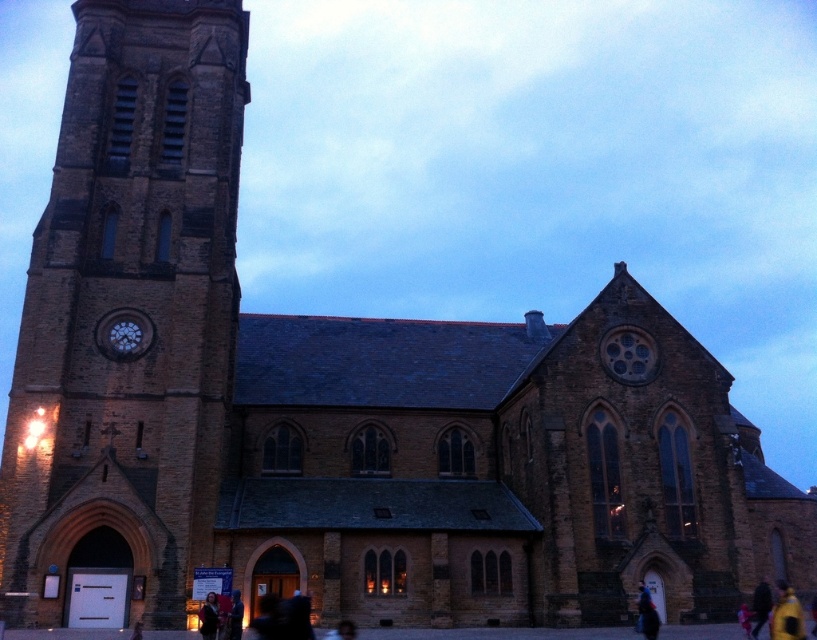
Question: Which is nearer to the dark blue jacket at lower right?

Choices:
 (A) yellow fabric jacket at lower right
 (B) dark brown leather jacket at center

Answer: (A)

Question: Which object is positioned closest to the dark brown leather jacket at center?

Choices:
 (A) yellow fabric bag at lower right
 (B) brown stone tower at left

Answer: (B)

Question: Which object is farther from the camera taking this photo?

Choices:
 (A) dark blue jacket at lower right
 (B) yellow fabric bag at lower right

Answer: (A)

Question: Is the position of dark brown leather jacket at lower left less distant than that of dark brown leather jacket at center?

Choices:
 (A) yes
 (B) no

Answer: (A)

Question: Does matte stone clock at upper left have a smaller size compared to dark blue jacket at lower right?

Choices:
 (A) no
 (B) yes

Answer: (A)

Question: Is yellow fabric jacket at lower right further to camera compared to dark brown leather jacket at center?

Choices:
 (A) yes
 (B) no

Answer: (A)